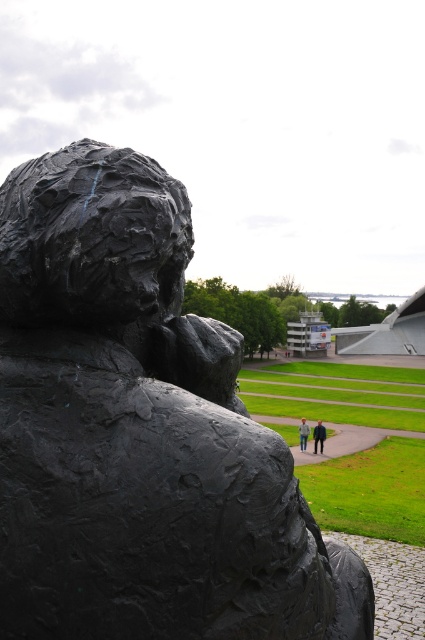
Question: Does blue jeans at center appear on the left side of light blue jeans at center?

Choices:
 (A) yes
 (B) no

Answer: (B)

Question: Which point appears farthest from the camera in this image?

Choices:
 (A) (61, 632)
 (B) (303, 422)

Answer: (B)

Question: Based on their relative distances, which object is farther from the light blue jeans at center?

Choices:
 (A) black matte sculpture at center
 (B) blue jeans at center

Answer: (A)

Question: Can you confirm if blue jeans at center is positioned below light blue jeans at center?

Choices:
 (A) yes
 (B) no

Answer: (A)

Question: Is blue jeans at center behind light blue jeans at center?

Choices:
 (A) yes
 (B) no

Answer: (B)

Question: Estimate the real-world distances between objects in this image. Which object is closer to the light blue jeans at center?

Choices:
 (A) black matte sculpture at center
 (B) blue jeans at center

Answer: (B)